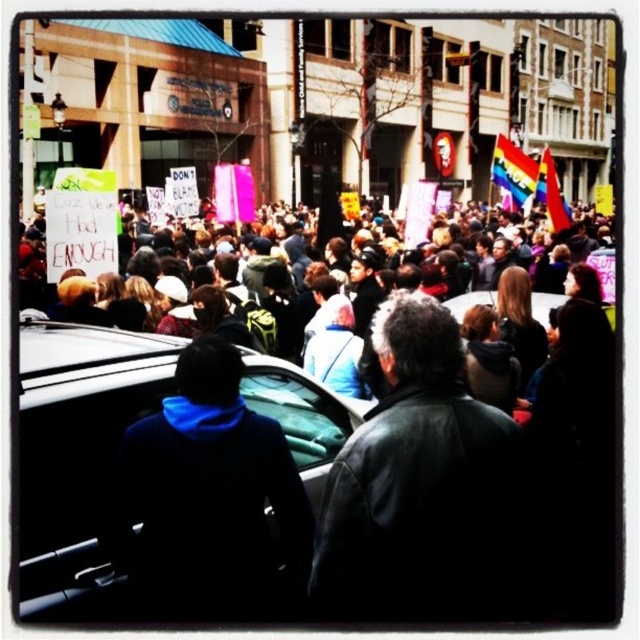
Is black matte car at center positioned at the back of multicolored fabric crowd at center?

No, black matte car at center is closer to the viewer.

Which is more to the right, black matte car at center or multicolored fabric crowd at center?

Positioned to the right is multicolored fabric crowd at center.

Which is behind, point (220, 568) or point (348, 364)?

The point (348, 364) is behind.

Where is `black matte car at center`? The width and height of the screenshot is (640, 640). black matte car at center is located at coordinates (160, 481).

Is point (355, 301) positioned behind point (392, 378)?

Yes, it is.

In the scene shown: Who is more forward, [68,278] or [483,556]?

Point [483,556] is more forward.

Does point (372, 262) lie in front of point (484, 483)?

No, (372, 262) is further to viewer.

Find the location of a particular element. The height and width of the screenshot is (640, 640). multicolored fabric crowd at center is located at coordinates (372, 304).

Can you confirm if black matte car at center is thinner than black leather jacket at center?

In fact, black matte car at center might be wider than black leather jacket at center.

Where is `black matte car at center`? black matte car at center is located at coordinates (160, 481).